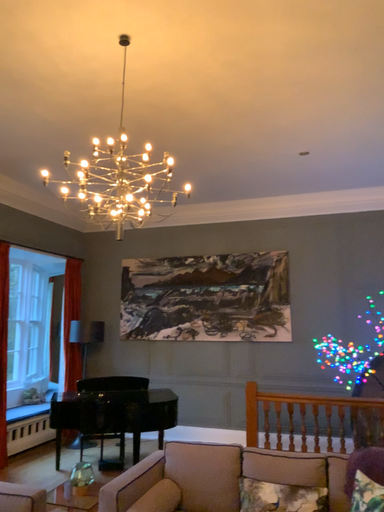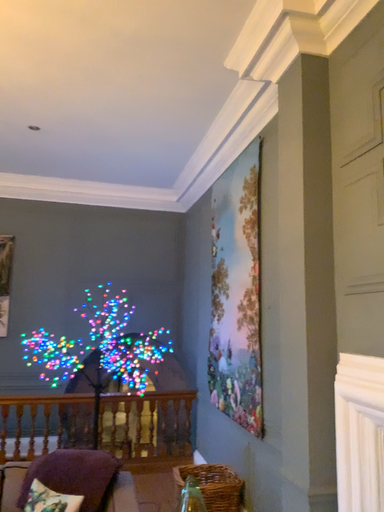
Question: How did the camera likely rotate when shooting the video?

Choices:
 (A) rotated left
 (B) rotated right

Answer: (B)